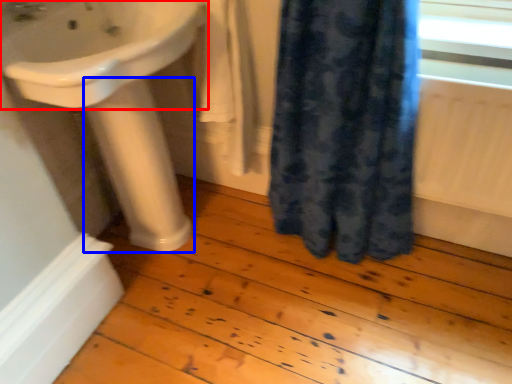
Question: Among these objects, which one is nearest to the camera, sink (highlighted by a red box) or pillar (highlighted by a blue box)?

Choices:
 (A) sink
 (B) pillar

Answer: (A)